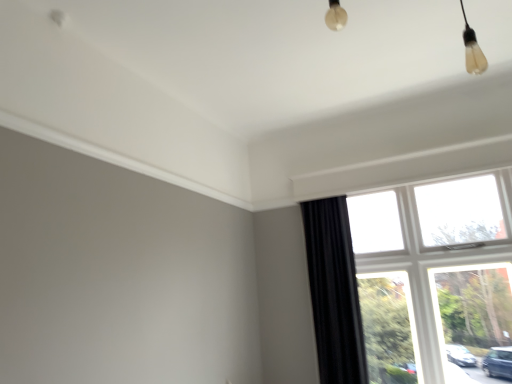
Question: Is black velvet curtain at right a part of white plastic window at right?

Choices:
 (A) yes
 (B) no

Answer: (B)

Question: Is white plastic window at right turned away from black velvet curtain at right?

Choices:
 (A) no
 (B) yes

Answer: (A)

Question: From a real-world perspective, is white plastic window at right physically above black velvet curtain at right?

Choices:
 (A) no
 (B) yes

Answer: (A)

Question: Does white plastic window at right have a lesser height compared to black velvet curtain at right?

Choices:
 (A) no
 (B) yes

Answer: (A)

Question: Is white plastic window at right directly adjacent to black velvet curtain at right?

Choices:
 (A) no
 (B) yes

Answer: (A)

Question: From a real-world perspective, is white plastic window at right located beneath black velvet curtain at right?

Choices:
 (A) no
 (B) yes

Answer: (B)

Question: Is black velvet curtain at right facing away from white plastic window at right?

Choices:
 (A) yes
 (B) no

Answer: (B)

Question: Is black velvet curtain at right wider than white plastic window at right?

Choices:
 (A) yes
 (B) no

Answer: (A)

Question: Is there a large distance between black velvet curtain at right and white plastic window at right?

Choices:
 (A) no
 (B) yes

Answer: (A)

Question: Is black velvet curtain at right oriented towards white plastic window at right?

Choices:
 (A) yes
 (B) no

Answer: (B)

Question: Is black velvet curtain at right positioned beyond the bounds of white plastic window at right?

Choices:
 (A) yes
 (B) no

Answer: (A)

Question: From a real-world perspective, is black velvet curtain at right physically above white plastic window at right?

Choices:
 (A) yes
 (B) no

Answer: (A)

Question: From their relative heights in the image, would you say black velvet curtain at right is taller or shorter than white plastic window at right?

Choices:
 (A) short
 (B) tall

Answer: (A)